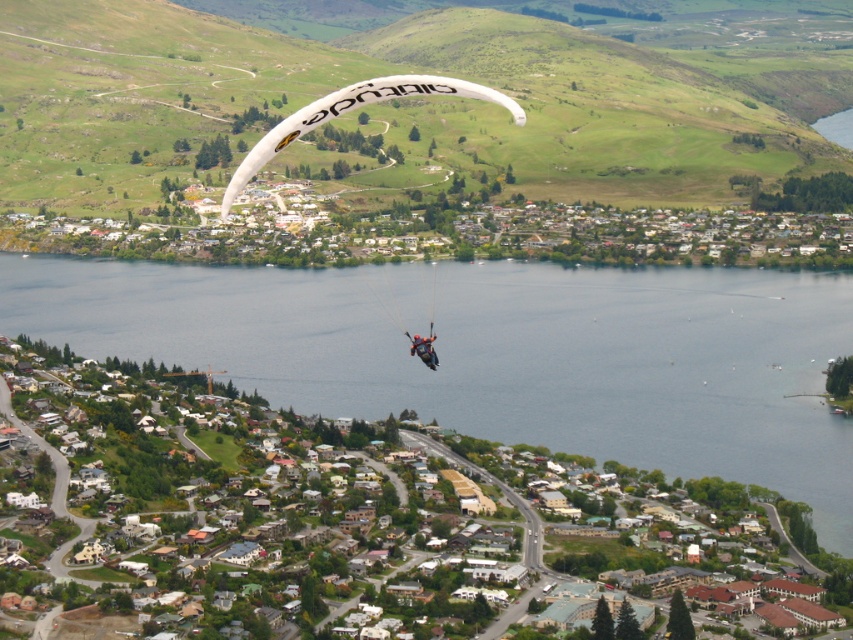
Who is more distant from viewer, (468,29) or (430,362)?

Positioned behind is point (468,29).

Can you confirm if white fabric parachute at center is positioned to the left of dark blue fabric parachute at center?

Yes, white fabric parachute at center is to the left of dark blue fabric parachute at center.

Is point (416, 120) farther from viewer compared to point (430, 344)?

Yes, it is.

Image resolution: width=853 pixels, height=640 pixels. Find the location of `white fabric parachute at center`. white fabric parachute at center is located at coordinates (422, 96).

Between blue water at center and dark blue fabric parachute at center, which one has more height?

blue water at center

Is point (33, 304) less distant than point (416, 336)?

No, it is behind (416, 336).

Locate an element on the screen. blue water at center is located at coordinates (500, 353).

Who is more forward, (415,324) or (502,93)?

Point (415,324)

What do you see at coordinates (500, 353) in the screenshot?
I see `blue water at center` at bounding box center [500, 353].

Locate an element on the screen. blue water at center is located at coordinates (500, 353).